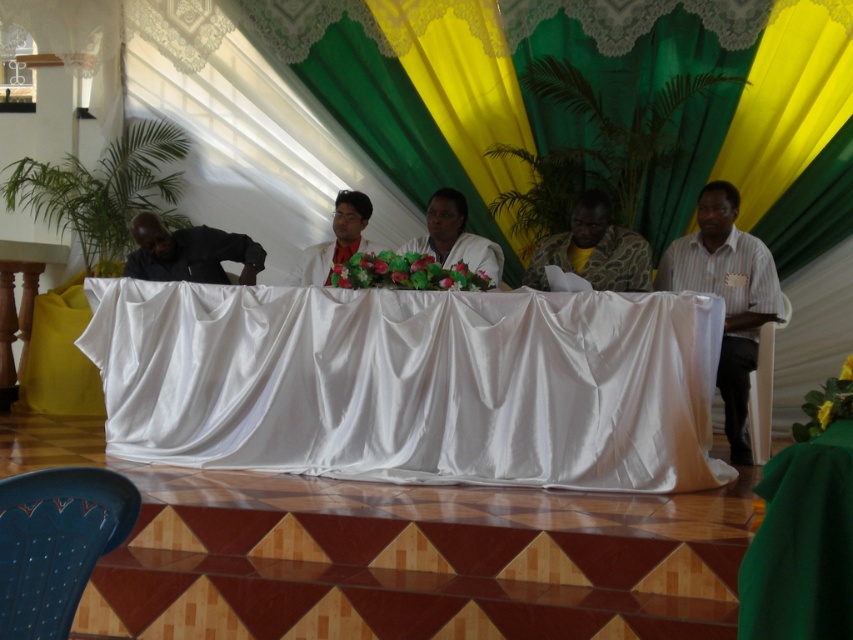
You are organizing a small event and need to place a 1.5 meter long rectangular cake on the table. Given the white satin table at center and the white fabric at center, which one can accommodate the cake without it hanging over the edge?

The white satin table at center is bigger than the white fabric at center, so the cake can be placed on the white satin table at center without hanging over the edge.

You are a photographer standing at the back of the conference room. You want to take a photo of both the striped cotton shirt at right and the black matte shirt at left in the same frame. Given that your camera has a maximum focus range of 3 meters, will you be able to capture both shirts in focus?

The striped cotton shirt at right and the black matte shirt at left are 3.61 meters apart. Since the distance between them exceeds the camera maximum focus range of 3 meters, you won t be able to capture both shirts in focus.